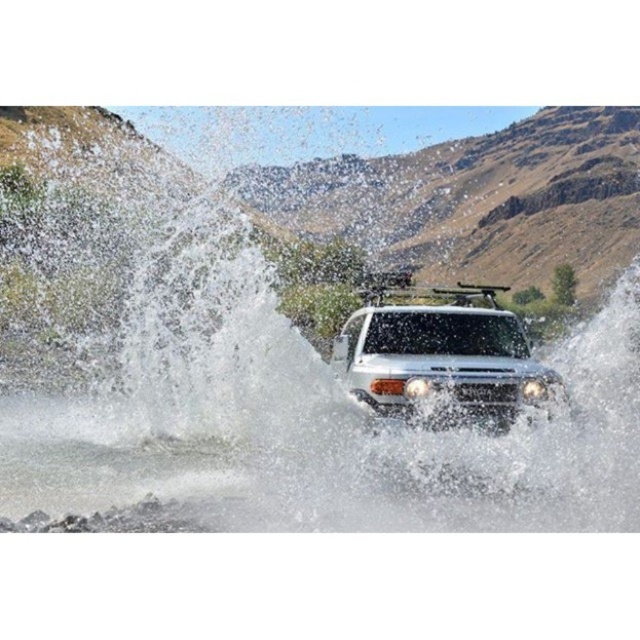
Does point (115, 228) lie in front of point (442, 368)?

That is False.

Who is positioned more to the left, white frothy water at center or white matte jeep at center?

white frothy water at center

Which is in front, point (392, 512) or point (493, 364)?

Positioned in front is point (392, 512).

This screenshot has width=640, height=640. What are the coordinates of `white frothy water at center` in the screenshot? It's located at (252, 372).